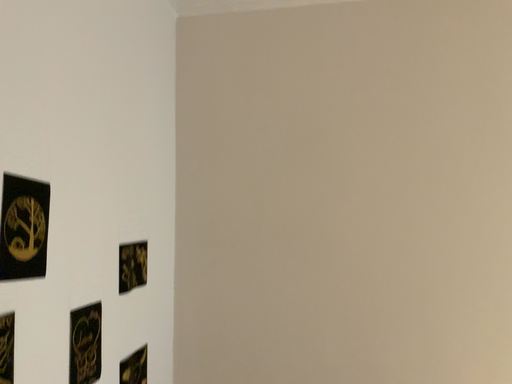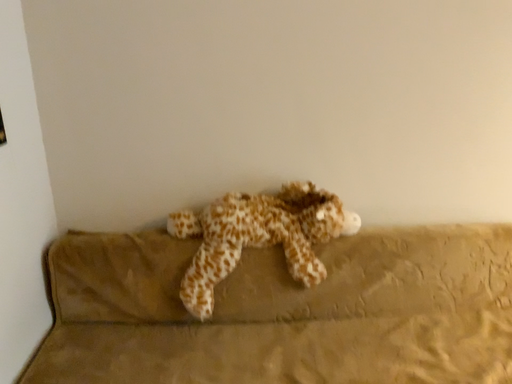
Question: Which way did the camera rotate in the video?

Choices:
 (A) rotated downward
 (B) rotated upward

Answer: (A)